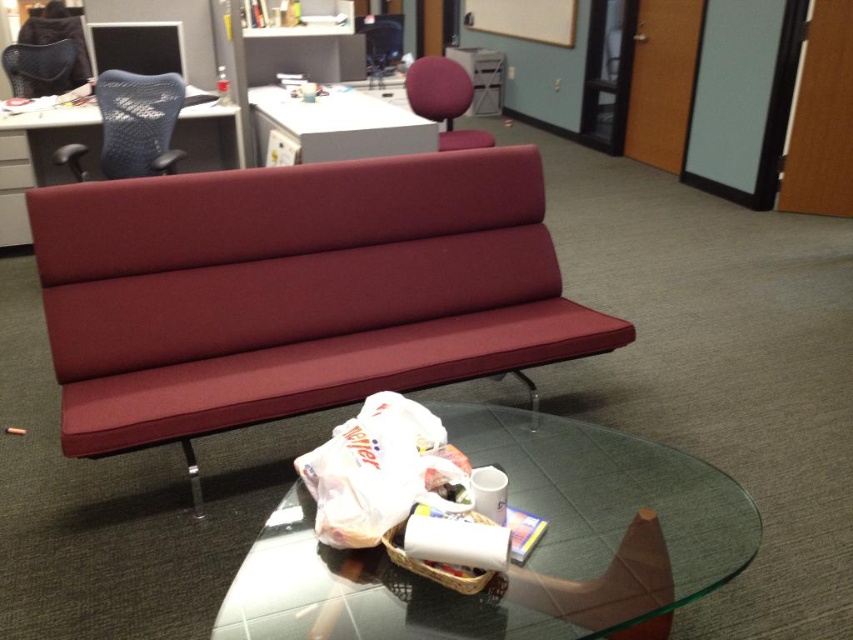
Question: Which of these objects is positioned farthest from the white plastic bag at center?

Choices:
 (A) white glossy table at upper center
 (B) matte black chair at upper left

Answer: (B)

Question: Which object is the farthest from the matte plastic table at upper center?

Choices:
 (A) transparent glass table at center
 (B) purple fabric swivel chair at upper center
 (C) white plastic bag at center
 (D) white glossy table at upper center

Answer: (A)

Question: Which of these objects is positioned farthest from the transparent glass table at center?

Choices:
 (A) matte black chair at upper left
 (B) white glossy table at upper center

Answer: (A)

Question: In this image, where is white glossy table at upper center located relative to matte black chair at upper left?

Choices:
 (A) left
 (B) right

Answer: (B)

Question: Can you confirm if transparent glass table at center is positioned above white glossy table at upper center?

Choices:
 (A) yes
 (B) no

Answer: (B)

Question: Is matte plastic table at upper center below white glossy table at upper center?

Choices:
 (A) yes
 (B) no

Answer: (A)